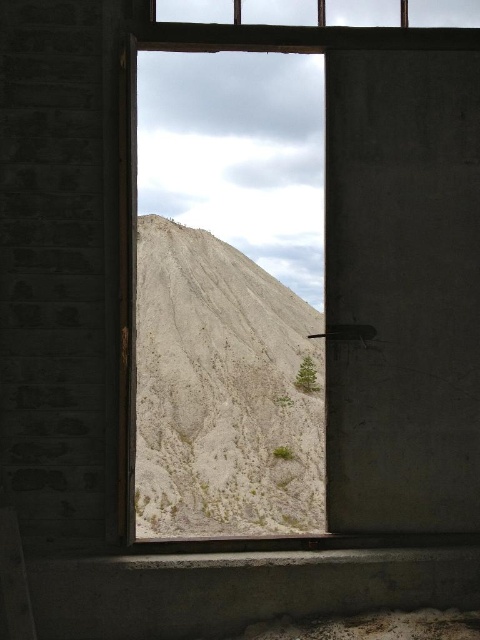
Question: Can you confirm if matte concrete window at center is smaller than white sandy hillside at center?

Choices:
 (A) yes
 (B) no

Answer: (A)

Question: Does matte concrete window at center appear under white sandy hillside at center?

Choices:
 (A) no
 (B) yes

Answer: (A)

Question: Does matte concrete window at center have a larger size compared to white sandy hillside at center?

Choices:
 (A) no
 (B) yes

Answer: (A)

Question: Which point is closer to the camera taking this photo?

Choices:
 (A) (445, 99)
 (B) (237, 467)

Answer: (A)

Question: Among these points, which one is nearest to the camera?

Choices:
 (A) (x=182, y=433)
 (B) (x=429, y=172)

Answer: (B)

Question: Which point appears closest to the camera in this image?

Choices:
 (A) (456, 102)
 (B) (197, 349)

Answer: (A)